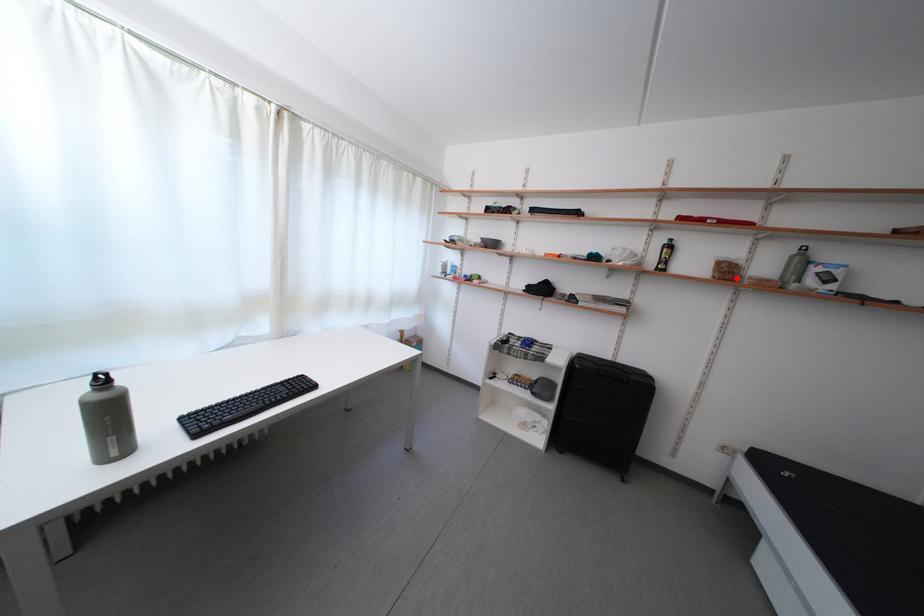
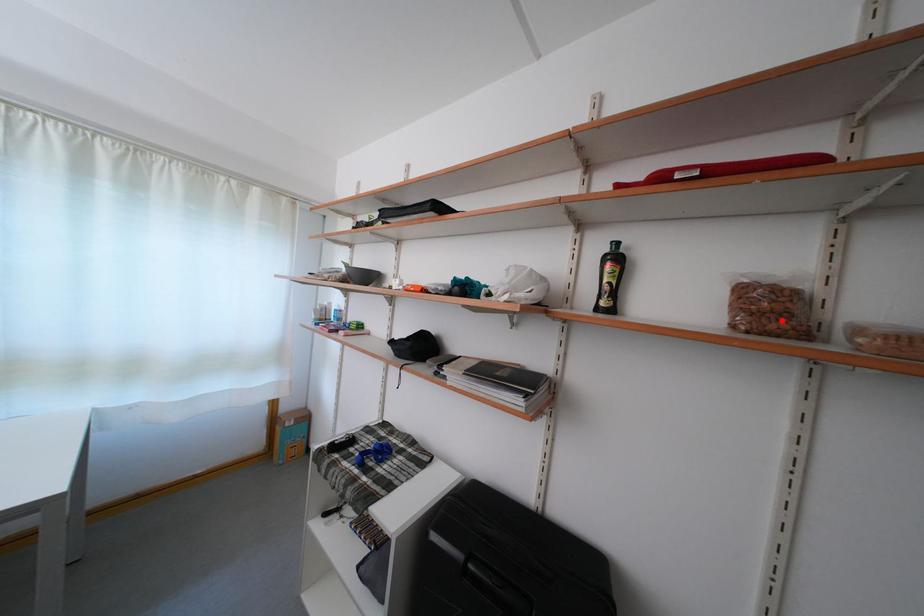
I am providing you with two images of the same scene from different viewpoints. A red point is marked on the first image and another point is marked on the second image. Do the highlighted points in image1 and image2 indicate the same real-world spot?

Yes